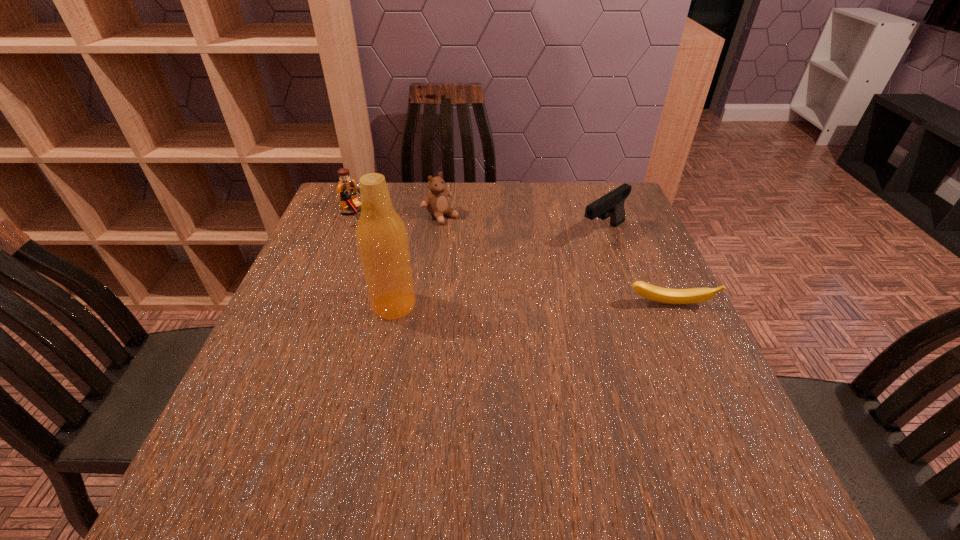
Image resolution: width=960 pixels, height=540 pixels. In order to click on banana at the right edge in this screenshot , I will do `click(654, 293)`.

Where is `pistol at the right edge`? The width and height of the screenshot is (960, 540). pistol at the right edge is located at coordinates (611, 205).

Where is `object situated at the far left corner`? object situated at the far left corner is located at coordinates (346, 189).

The width and height of the screenshot is (960, 540). Find the location of `object located in the far right corner section of the desktop`. object located in the far right corner section of the desktop is located at coordinates coord(611,205).

Find the location of `vacant region at the far edge of the desktop`. vacant region at the far edge of the desktop is located at coordinates (469, 225).

Where is `free space at the near edge of the desktop`? This screenshot has height=540, width=960. free space at the near edge of the desktop is located at coordinates (507, 433).

Where is `free space at the left edge`? Image resolution: width=960 pixels, height=540 pixels. free space at the left edge is located at coordinates (300, 380).

Where is `vacant region at the right edge`? The height and width of the screenshot is (540, 960). vacant region at the right edge is located at coordinates (645, 379).

Identify the location of blank space at the far left corner of the desktop. The height and width of the screenshot is (540, 960). (332, 201).

Locate an element on the screen. vacant space at the far right corner of the desktop is located at coordinates (591, 194).